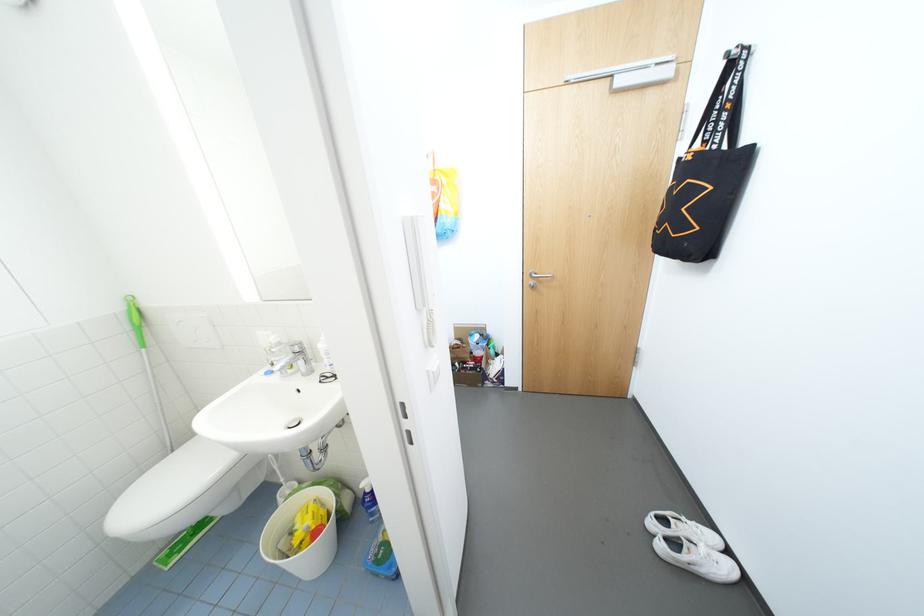
Locate an element on the screen. The image size is (924, 616). metal door handle is located at coordinates (537, 278).